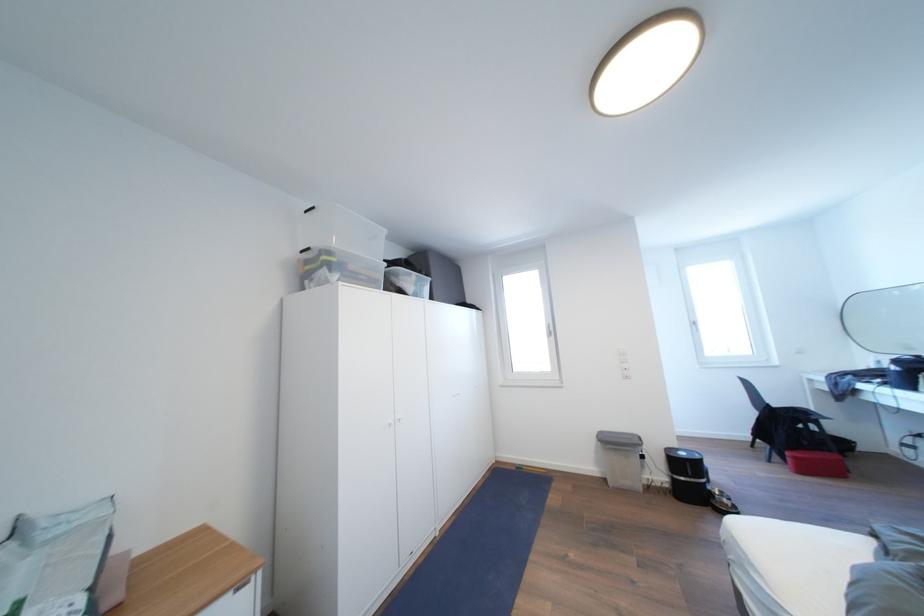
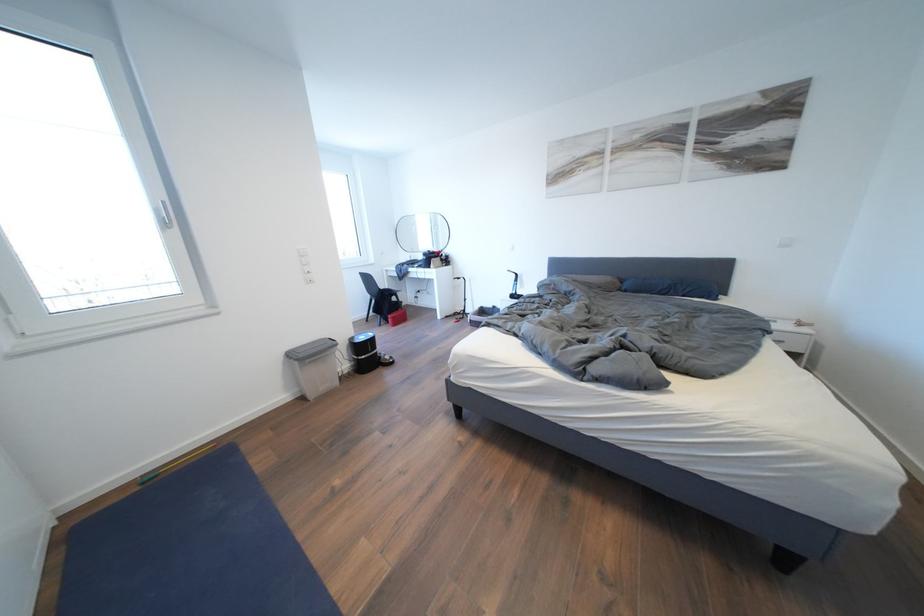
Question: The first image is from the beginning of the video and the second image is from the end. How did the camera likely rotate when shooting the video?

Choices:
 (A) Left
 (B) Right
 (C) Up
 (D) Down

Answer: (B)